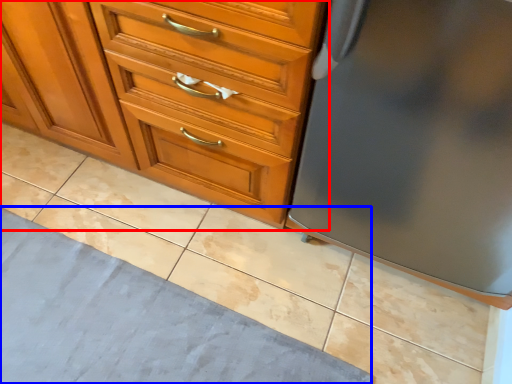
Question: Which object appears farthest to the camera in this image, chest of drawers (highlighted by a red box) or bath mat (highlighted by a blue box)?

Choices:
 (A) chest of drawers
 (B) bath mat

Answer: (B)